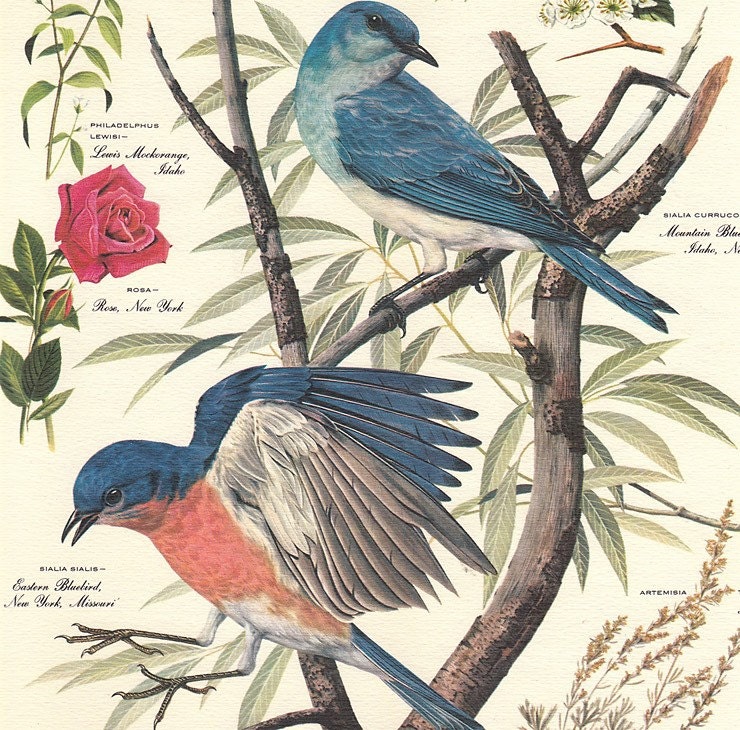
Image resolution: width=740 pixels, height=730 pixels. I want to click on red chest, so click(194, 560).